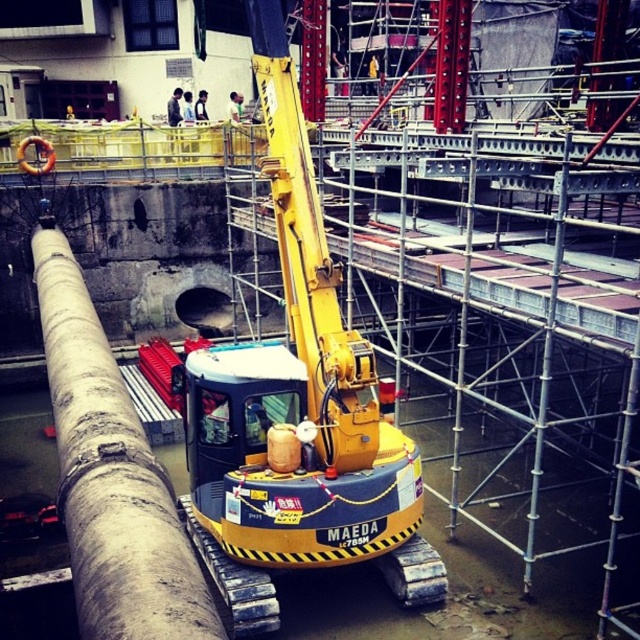
Does yellow rubbermaid excavator at center appear on the right side of gray concrete pipe at center?

Correct, you'll find yellow rubbermaid excavator at center to the right of gray concrete pipe at center.

Between point (266, 452) and point (189, 620), which one is positioned in front?

Point (189, 620) is in front.

What are the coordinates of `yellow rubbermaid excavator at center` in the screenshot? It's located at (298, 406).